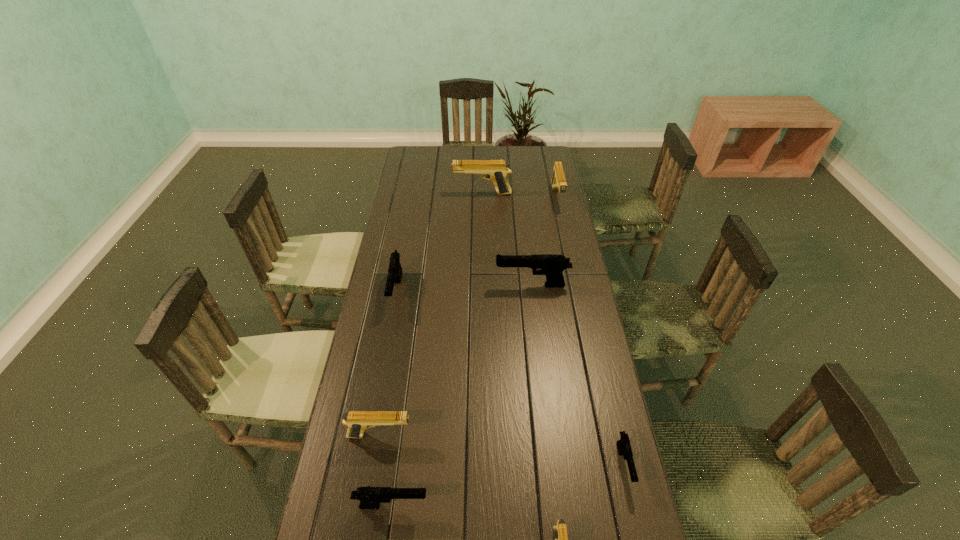
Where is `free location located on the front-facing side of the seventh farthest object`? free location located on the front-facing side of the seventh farthest object is located at coordinates (555, 505).

Locate an element on the screen. vacant position located on the front-facing side of the third nearest object is located at coordinates (636, 522).

Where is `free space at the far edge`? This screenshot has height=540, width=960. free space at the far edge is located at coordinates (515, 155).

Identify the location of blank area at the left edge. The image size is (960, 540). (429, 206).

You are a GUI agent. You are given a task and a screenshot of the screen. Output one action in this format:
    pyautogui.click(x=<x>, y=<y>)
    Task: Click on the free region at the right edge
    Image resolution: width=960 pixels, height=540 pixels.
    Given the screenshot: What is the action you would take?
    pyautogui.click(x=540, y=213)

Identify the location of free space at the far left corner. (426, 148).

Where is `vacant space that's between the third smallest black pistol and the seventh object from left to right`? This screenshot has width=960, height=540. vacant space that's between the third smallest black pistol and the seventh object from left to right is located at coordinates (476, 245).

Find the location of `free space between the second pistol from right to left and the second biggest black pistol`. free space between the second pistol from right to left and the second biggest black pistol is located at coordinates (476, 245).

Image resolution: width=960 pixels, height=540 pixels. Find the location of `free space between the third nearest object and the biggest tan pistol`. free space between the third nearest object and the biggest tan pistol is located at coordinates click(553, 329).

Find the location of a particular element. Image resolution: width=960 pixels, height=540 pixels. empty space that is in between the second nearest pistol and the third biggest tan pistol is located at coordinates 386,470.